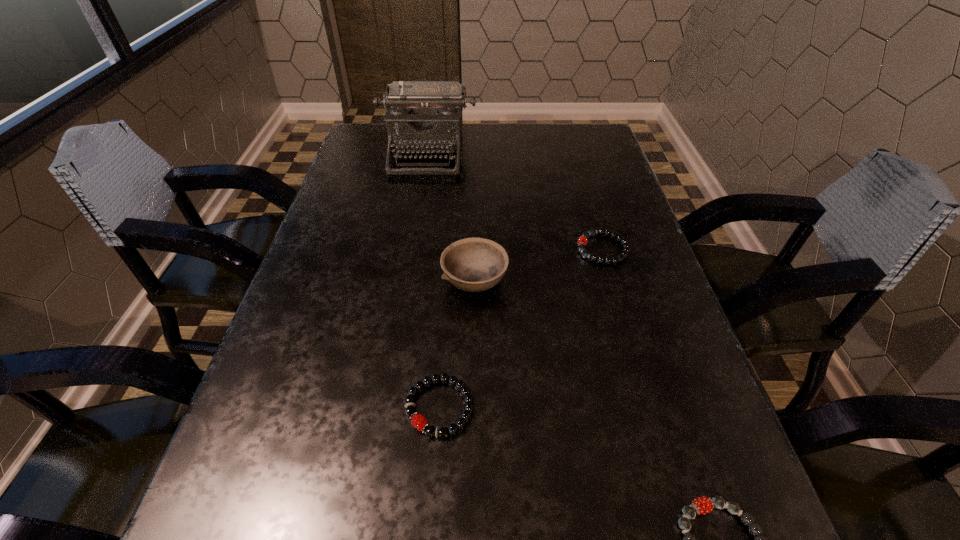
Where is `free space between the farthest bracelet and the tallest object`? This screenshot has height=540, width=960. free space between the farthest bracelet and the tallest object is located at coordinates (515, 201).

The height and width of the screenshot is (540, 960). What are the coordinates of `free space between the farthest bracelet and the bowl` in the screenshot? It's located at (539, 266).

Identify the location of vacant space in between the leftmost bracelet and the farthest bracelet. (521, 328).

I want to click on vacant region between the farthest bracelet and the typewriter, so click(515, 201).

Identify which object is the fourth closest to the nearest bracelet. Please provide its 2D coordinates. Your answer should be formatted as a tuple, i.e. [(x, y)], where the tuple contains the x and y coordinates of a point satisfying the conditions above.

[(423, 117)]

Locate which object is the closest to the farthest bracelet. Please provide its 2D coordinates. Your answer should be formatted as a tuple, i.e. [(x, y)], where the tuple contains the x and y coordinates of a point satisfying the conditions above.

[(473, 264)]

Locate an element on the screen. The width and height of the screenshot is (960, 540). bracelet that can be found as the closest to the second tallest object is located at coordinates (582, 241).

This screenshot has height=540, width=960. I want to click on the closest bracelet to the bowl, so click(x=582, y=241).

The image size is (960, 540). Find the location of `free space that satisfies the following two spatial constraints: 1. on the typing side of the fourth farthest object; 2. on the left side of the farthest object`. free space that satisfies the following two spatial constraints: 1. on the typing side of the fourth farthest object; 2. on the left side of the farthest object is located at coordinates (385, 407).

You are a GUI agent. You are given a task and a screenshot of the screen. Output one action in this format:
    pyautogui.click(x=<x>, y=<y>)
    Task: Click on the vacant area that satisfies the following two spatial constraints: 1. on the typing side of the leftmost bracelet; 2. on the left side of the typewriter
    Image resolution: width=960 pixels, height=540 pixels.
    Given the screenshot: What is the action you would take?
    pyautogui.click(x=385, y=407)